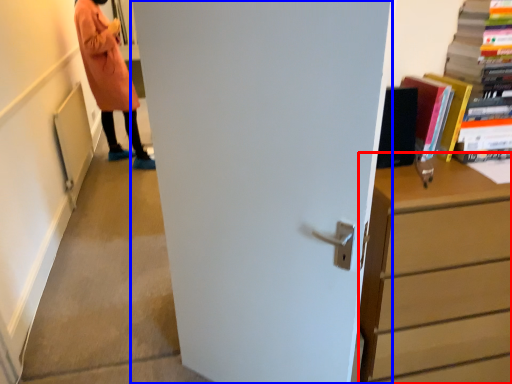
Question: Among these objects, which one is farthest to the camera, chest of drawers (highlighted by a red box) or door (highlighted by a blue box)?

Choices:
 (A) chest of drawers
 (B) door

Answer: (A)